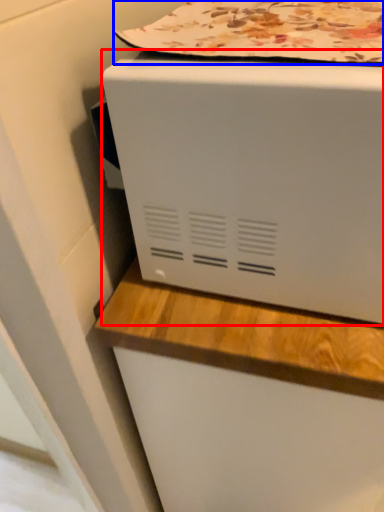
Question: Which object is further to the camera taking this photo, home appliance (highlighted by a red box) or blanket (highlighted by a blue box)?

Choices:
 (A) home appliance
 (B) blanket

Answer: (B)